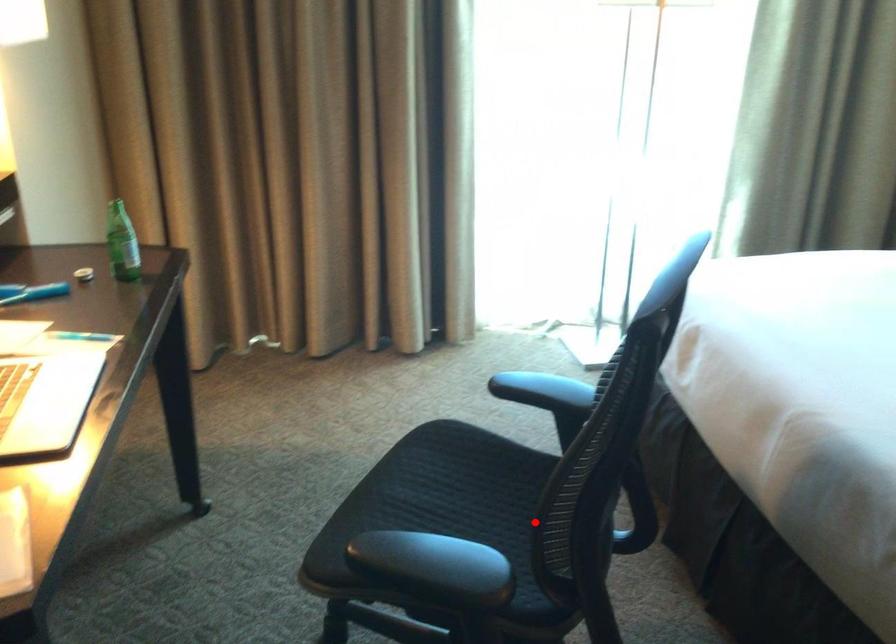
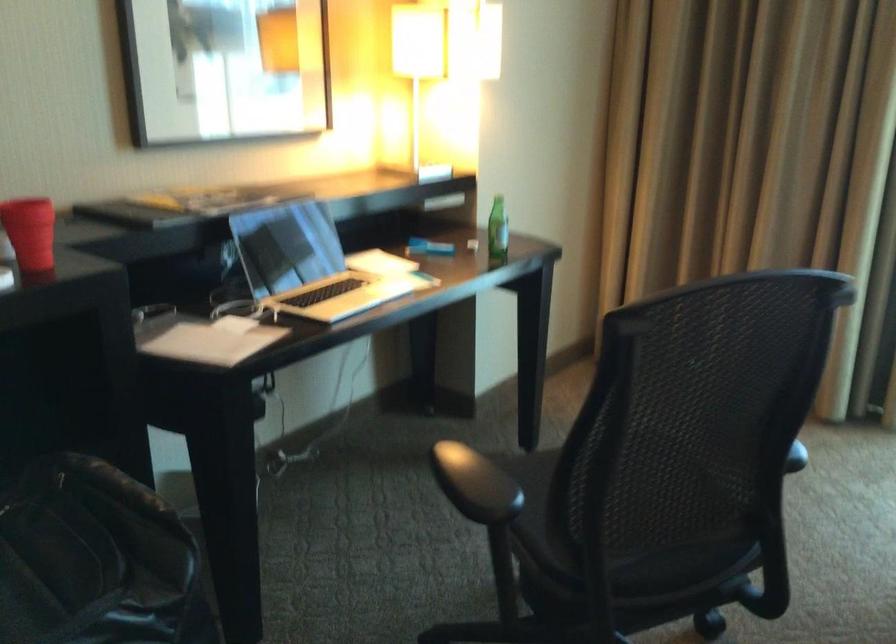
In the second image, find the point that corresponds to the highlighted location in the first image.

(558, 480)